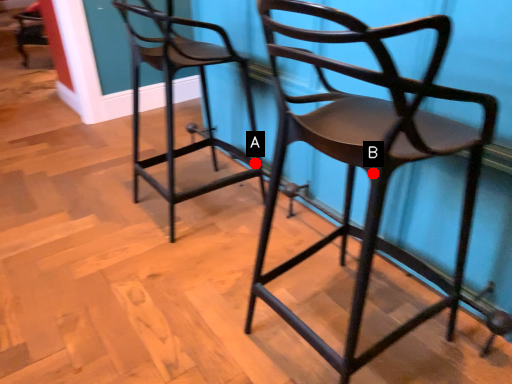
Question: Two points are circled on the image, labeled by A and B beside each circle. Which point is farther to the camera?

Choices:
 (A) A is further
 (B) B is further

Answer: (A)